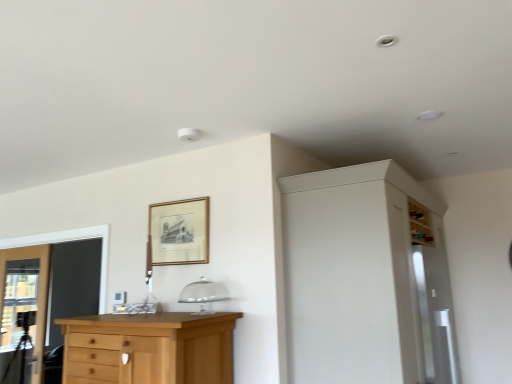
This screenshot has height=384, width=512. Describe the element at coordinates (433, 299) in the screenshot. I see `transparent glass screen door at right` at that location.

Find the location of a particular element. The width and height of the screenshot is (512, 384). gold wooden picture frame at upper center is located at coordinates (179, 232).

What do you see at coordinates (366, 278) in the screenshot? The height and width of the screenshot is (384, 512). I see `white matte cabinet at upper right` at bounding box center [366, 278].

The image size is (512, 384). Describe the element at coordinates (23, 310) in the screenshot. I see `clear glass door at left` at that location.

This screenshot has height=384, width=512. I want to click on transparent glass screen door at right, so tap(433, 299).

Between clear glass door at left and white matte cabinet at upper right, which one is positioned behind?

clear glass door at left.

Is white matte cabinet at upper right at the back of clear glass door at left?

That's not correct — clear glass door at left is not looking away from white matte cabinet at upper right.

From a real-world perspective, which object rests below the other?

clear glass door at left is physically lower.

How distant is clear glass door at left from white matte cabinet at upper right?

A distance of 9.18 feet exists between clear glass door at left and white matte cabinet at upper right.

Which object is thinner, white matte cabinet at upper right or clear glass door at left?

clear glass door at left.

Is white matte cabinet at upper right taller than clear glass door at left?

Indeed, white matte cabinet at upper right has a greater height compared to clear glass door at left.

Consider the image. From a real-world perspective, which object stands above the other?

white matte cabinet at upper right.

How much distance is there between gold wooden picture frame at upper center and white matte cabinet at upper right?

gold wooden picture frame at upper center and white matte cabinet at upper right are 38.96 inches apart from each other.

From a real-world perspective, is gold wooden picture frame at upper center over white matte cabinet at upper right?

Indeed, from a real-world perspective, gold wooden picture frame at upper center stands above white matte cabinet at upper right.

Does gold wooden picture frame at upper center have a lesser width compared to white matte cabinet at upper right?

Indeed, gold wooden picture frame at upper center has a lesser width compared to white matte cabinet at upper right.

You are a GUI agent. You are given a task and a screenshot of the screen. Output one action in this format:
    pyautogui.click(x=<x>, y=<y>)
    Task: Click on the picture frame above the white matte cabinet at upper right (from a real-world perspective)
    
    Given the screenshot: What is the action you would take?
    pyautogui.click(x=179, y=232)

From a real-world perspective, which is physically below, transparent glass screen door at right or white matte cabinet at upper right?

transparent glass screen door at right is physically lower.

Is transparent glass screen door at right in contact with white matte cabinet at upper right?

No, transparent glass screen door at right is not with white matte cabinet at upper right.

Is transparent glass screen door at right at the left side of white matte cabinet at upper right?

No.

Is transparent glass screen door at right not within white matte cabinet at upper right?

Actually, transparent glass screen door at right is within white matte cabinet at upper right.

Would you consider clear glass door at left to be distant from transparent glass screen door at right?

Yes.

Does clear glass door at left have a lesser height compared to transparent glass screen door at right?

No, clear glass door at left is not shorter than transparent glass screen door at right.

From a real-world perspective, which is physically below, clear glass door at left or transparent glass screen door at right?

In real-world perspective, transparent glass screen door at right is lower.

From a real-world perspective, is light brown wood chest of drawers at lower left under transparent glass screen door at right?

Correct, in the physical world, light brown wood chest of drawers at lower left is lower than transparent glass screen door at right.

Considering the sizes of objects light brown wood chest of drawers at lower left and transparent glass screen door at right in the image provided, who is wider, light brown wood chest of drawers at lower left or transparent glass screen door at right?

With larger width is light brown wood chest of drawers at lower left.

Does light brown wood chest of drawers at lower left have a lesser height compared to transparent glass screen door at right?

Yes, light brown wood chest of drawers at lower left is shorter than transparent glass screen door at right.

Looking at the image, does light brown wood chest of drawers at lower left seem bigger or smaller compared to transparent glass screen door at right?

Considering their sizes, light brown wood chest of drawers at lower left takes up less space than transparent glass screen door at right.

Is point (420, 222) positioned behind point (23, 340)?

No, (420, 222) is closer to viewer.

From a real-world perspective, is transparent glass screen door at right positioned above or below clear glass door at left?

In terms of real-world spatial position, transparent glass screen door at right is below clear glass door at left.

From the image's perspective, does transparent glass screen door at right appear lower than clear glass door at left?

No, from the image's perspective, transparent glass screen door at right is not below clear glass door at left.

Find the location of a particular element. Image resolution: width=512 pixels, height=384 pixels. screen door below the clear glass door at left (from a real-world perspective) is located at coordinates point(433,299).

Where is `dresser on the right of clear glass door at left`? The image size is (512, 384). dresser on the right of clear glass door at left is located at coordinates (366, 278).

Find the location of a particular element. The height and width of the screenshot is (384, 512). door on the left of white matte cabinet at upper right is located at coordinates (23, 310).

Which object lies further to the anchor point clear glass door at left, gold wooden picture frame at upper center or transparent glass screen door at right?

Based on the image, transparent glass screen door at right appears to be further to clear glass door at left.

Looking at this image, based on their spatial positions, is light brown wood chest of drawers at lower left or gold wooden picture frame at upper center further from transparent glass screen door at right?

gold wooden picture frame at upper center is further to transparent glass screen door at right.

Estimate the real-world distances between objects in this image. Which object is further from transparent glass screen door at right, clear glass door at left or gold wooden picture frame at upper center?

clear glass door at left lies further to transparent glass screen door at right than the other object.

Considering their positions, is clear glass door at left positioned closer to transparent glass screen door at right than light brown wood chest of drawers at lower left?

light brown wood chest of drawers at lower left is positioned closer to the anchor transparent glass screen door at right.

Estimate the real-world distances between objects in this image. Which object is closer to clear glass door at left, transparent glass screen door at right or white matte cabinet at upper right?

white matte cabinet at upper right lies closer to clear glass door at left than the other object.

Estimate the real-world distances between objects in this image. Which object is closer to white matte cabinet at upper right, gold wooden picture frame at upper center or clear glass door at left?

gold wooden picture frame at upper center.

When comparing their distances from transparent glass screen door at right, does light brown wood chest of drawers at lower left or clear glass door at left seem further?

Among the two, clear glass door at left is located further to transparent glass screen door at right.

Looking at this image, which object lies nearer to the anchor point white matte cabinet at upper right, gold wooden picture frame at upper center or light brown wood chest of drawers at lower left?

The object closer to white matte cabinet at upper right is light brown wood chest of drawers at lower left.

Locate an element on the screen. picture frame located between clear glass door at left and white matte cabinet at upper right in the left-right direction is located at coordinates (179, 232).

Where is `dresser between clear glass door at left and transparent glass screen door at right in the horizontal direction`? dresser between clear glass door at left and transparent glass screen door at right in the horizontal direction is located at coordinates (366, 278).

Where is `picture frame between light brown wood chest of drawers at lower left and transparent glass screen door at right from left to right`? The height and width of the screenshot is (384, 512). picture frame between light brown wood chest of drawers at lower left and transparent glass screen door at right from left to right is located at coordinates (179, 232).

Locate an element on the screen. The height and width of the screenshot is (384, 512). picture frame located between clear glass door at left and transparent glass screen door at right in the left-right direction is located at coordinates (179, 232).